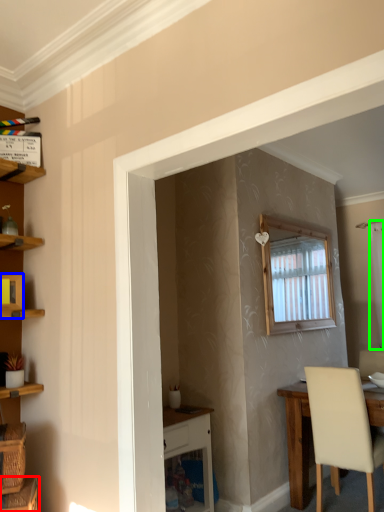
Question: Estimate the real-world distances between objects in this image. Which object is farther from basket (highlighted by a red box), cabinet (highlighted by a blue box) or curtain (highlighted by a green box)?

Choices:
 (A) cabinet
 (B) curtain

Answer: (B)